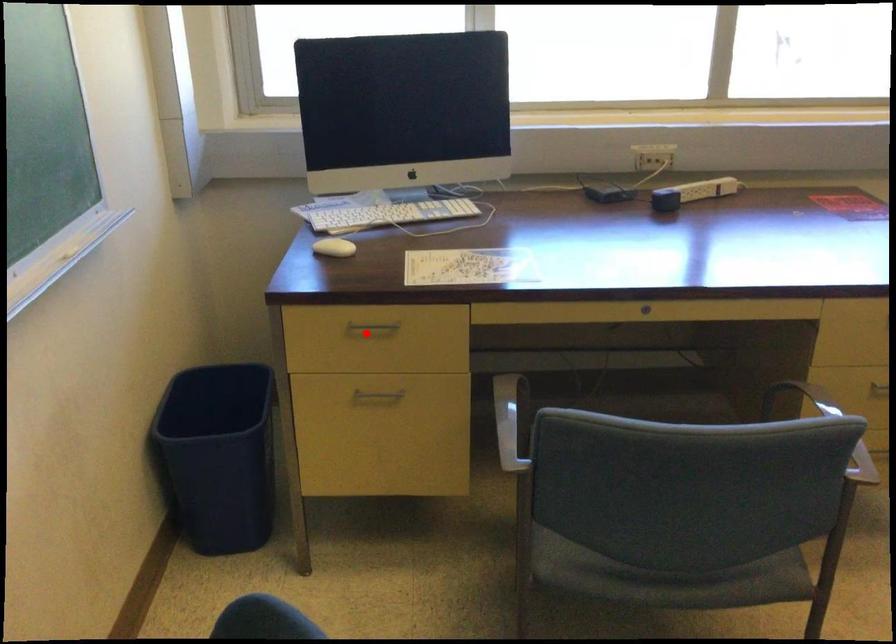
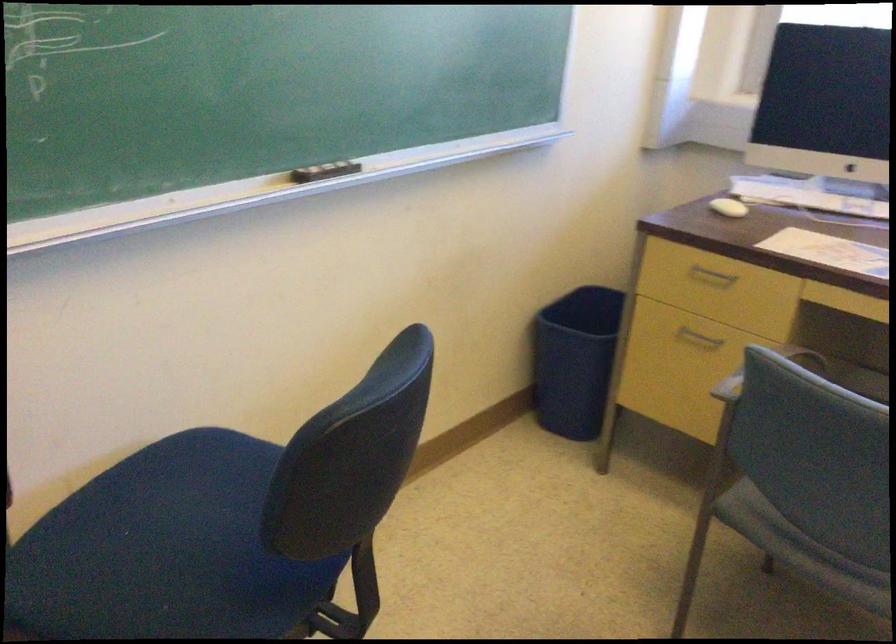
Question: I am providing you with two images of the same scene from different viewpoints. In image1, a red point is highlighted. Considering the same 3D point in image2, which of the following is correct?

Choices:
 (A) It is closer
 (B) It is farther

Answer: (B)